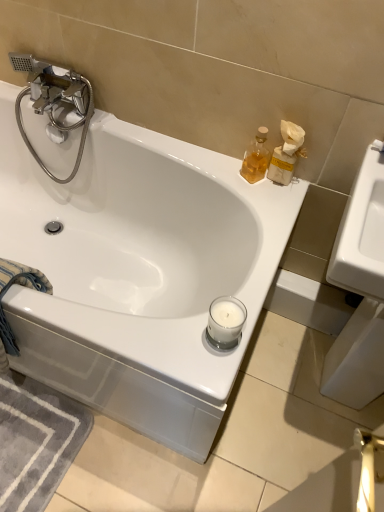
Question: From a real-world perspective, is white glossy bathtub at upper center on blue cotton towel at lower left?

Choices:
 (A) no
 (B) yes

Answer: (A)

Question: Can you confirm if white glossy bathtub at upper center is smaller than blue cotton towel at lower left?

Choices:
 (A) yes
 (B) no

Answer: (B)

Question: Could you tell me if white glossy bathtub at upper center is turned towards blue cotton towel at lower left?

Choices:
 (A) yes
 (B) no

Answer: (A)

Question: Considering the relative positions of white glossy bathtub at upper center and blue cotton towel at lower left in the image provided, is white glossy bathtub at upper center to the right of blue cotton towel at lower left from the viewer's perspective?

Choices:
 (A) no
 (B) yes

Answer: (B)

Question: Considering the relative positions of white glossy bathtub at upper center and blue cotton towel at lower left in the image provided, is white glossy bathtub at upper center to the left of blue cotton towel at lower left from the viewer's perspective?

Choices:
 (A) no
 (B) yes

Answer: (A)

Question: Considering the positions of point (1, 267) and point (258, 172), is point (1, 267) closer or farther from the camera than point (258, 172)?

Choices:
 (A) farther
 (B) closer

Answer: (B)

Question: From the image's perspective, is blue cotton towel at lower left positioned above or below translucent glass soap dispenser at upper right?

Choices:
 (A) above
 (B) below

Answer: (B)

Question: Is blue cotton towel at lower left wider or thinner than translucent glass soap dispenser at upper right?

Choices:
 (A) wide
 (B) thin

Answer: (A)

Question: Is blue cotton towel at lower left in front of or behind translucent glass soap dispenser at upper right in the image?

Choices:
 (A) front
 (B) behind

Answer: (A)

Question: Considering their positions, is white glossy bathtub at upper center located in front of or behind translucent glass soap dispenser at upper right?

Choices:
 (A) behind
 (B) front

Answer: (B)

Question: From their relative heights in the image, would you say white glossy bathtub at upper center is taller or shorter than translucent glass soap dispenser at upper right?

Choices:
 (A) short
 (B) tall

Answer: (B)

Question: In terms of size, does white glossy bathtub at upper center appear bigger or smaller than translucent glass soap dispenser at upper right?

Choices:
 (A) big
 (B) small

Answer: (A)

Question: Is white glossy bathtub at upper center wider or thinner than translucent glass soap dispenser at upper right?

Choices:
 (A) wide
 (B) thin

Answer: (A)

Question: Considering their positions, is translucent glass soap dispenser at upper right located in front of or behind chrome/metallic faucet at upper left?

Choices:
 (A) behind
 (B) front

Answer: (B)

Question: From the image's perspective, is translucent glass soap dispenser at upper right located above or below chrome/metallic faucet at upper left?

Choices:
 (A) above
 (B) below

Answer: (B)